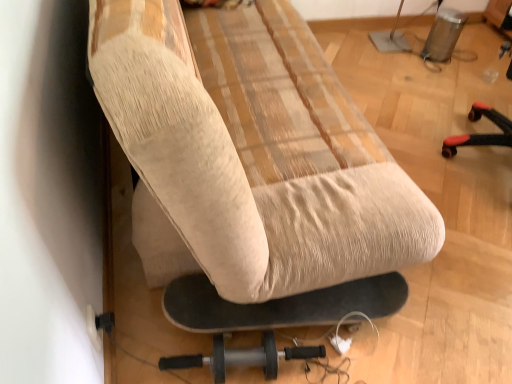
This screenshot has height=384, width=512. What do you see at coordinates (255, 156) in the screenshot? I see `black rubber skateboard at lower center` at bounding box center [255, 156].

You are a GUI agent. You are given a task and a screenshot of the screen. Output one action in this format:
    pyautogui.click(x=<x>, y=<y>)
    Task: Click on the black rubber skateboard at lower center
    The image size is (512, 384).
    Given the screenshot: What is the action you would take?
    pyautogui.click(x=255, y=156)

Identify the location of black rubber skateboard at lower center. The width and height of the screenshot is (512, 384). (255, 156).